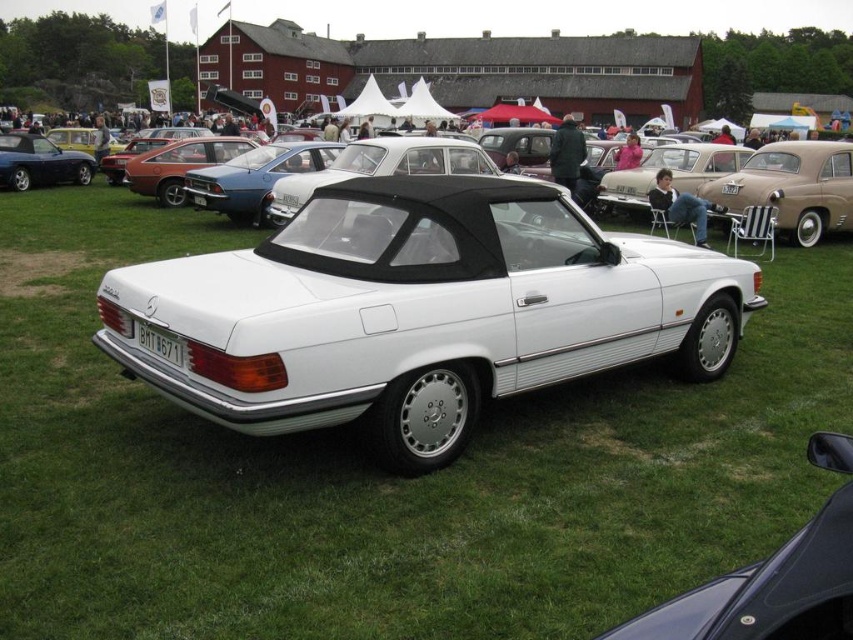
Question: Does white matte convertible at center have a smaller size compared to matte black convertible at left?

Choices:
 (A) no
 (B) yes

Answer: (A)

Question: Which object appears farthest from the camera in this image?

Choices:
 (A) white matte convertible at center
 (B) beige leather car at center
 (C) matte black convertible at left

Answer: (C)

Question: Which of the following is the closest to the observer?

Choices:
 (A) (761, 157)
 (B) (166, 352)
 (C) (16, 152)

Answer: (B)

Question: Does beige leather car at center have a greater width compared to white plastic license plate at rear?

Choices:
 (A) yes
 (B) no

Answer: (B)

Question: Estimate the real-world distances between objects in this image. Which object is farther from the white plastic license plate at rear?

Choices:
 (A) white metallic convertible at center
 (B) white matte convertible at center
 (C) beige leather car at center

Answer: (C)

Question: Does white metallic convertible at center have a lesser width compared to white plastic license plate at rear?

Choices:
 (A) no
 (B) yes

Answer: (A)